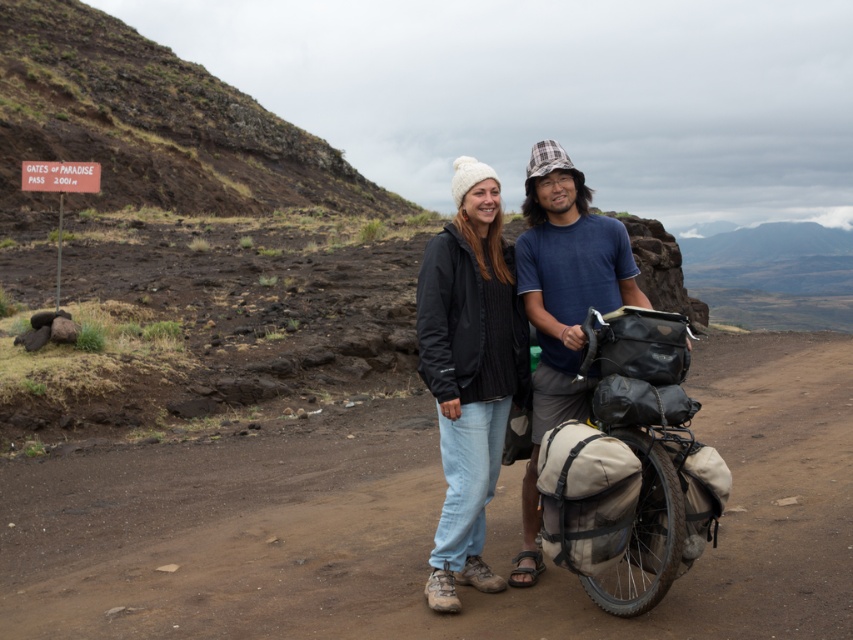
You are a photographer trying to capture the two jackets in the scene. Which jacket, the black fleece jacket at center or the matte black jacket at center, is positioned higher in the image?

The black fleece jacket at center is positioned higher in the image than the matte black jacket at center according to the description.

You are planning to buy a jacket for a hiking trip. You see two jackets in the image, the black fleece jacket at center and the matte black jacket at center. Which one is wider?

The black fleece jacket at center is wider than the matte black jacket at center according to the description.

You are planning to walk along the brown dirt track at center while wearing the black fleece jacket at center. Since the track is narrow, will the jacket interfere with your movement?

The brown dirt track at center is wider than the black fleece jacket at center, so the jacket will not interfere with your movement.